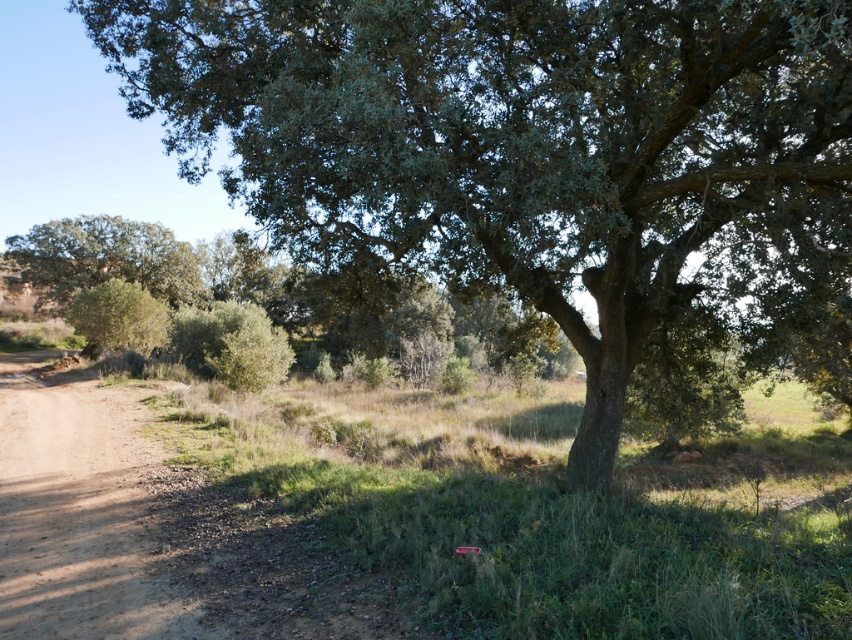
You are standing at the point with coordinates 0.5, 0.5 in this image. Which direction should you move to get closer to the green leafy tree at center?

Since the green leafy tree at center is located at coordinates (521,147), and you are at (426,320), you should move towards the northwest direction to get closer to it.

You are standing at the edge of the green leafy tree at center and want to walk to the brown dirt track at lower left. Which direction should you face to walk directly towards the track?

Since the green leafy tree at center is closer to the viewer than the brown dirt track at lower left, you should face towards the lower left direction to walk directly towards the track.